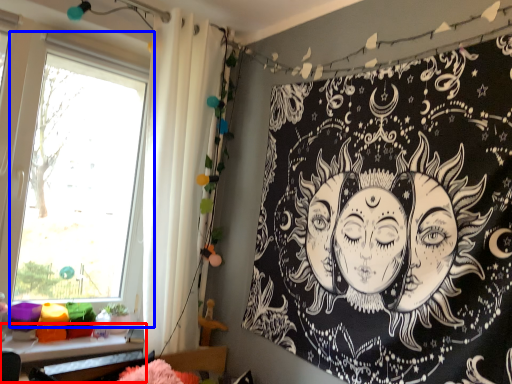
Question: Which point is closer to the camera, table (highlighted by a red box) or window (highlighted by a blue box)?

Choices:
 (A) table
 (B) window

Answer: (B)